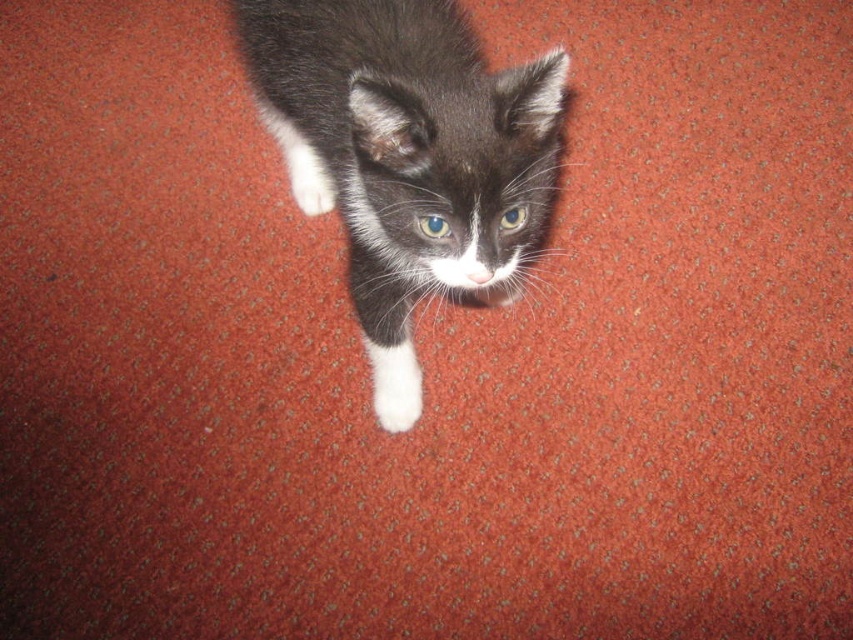
Looking at this image, you are a photographer trying to capture the black and white fur kitten at center and the white fluffy paw at center in a single frame. Since you want to ensure both are visible, which one should you focus on to avoid blurring due to their size difference?

You should focus on the black and white fur kitten at center because it is larger in size than the white fluffy paw at center, making it more likely to remain in focus if the camera is set to prioritize larger objects.

You are holding a 1.5 meter long fishing rod and want to cast it from your current position to the point marked at point (x=334, y=45). Can you reach that point with your fishing rod?

The distance between you and point (x=334, y=45) is 1.25 meters, so yes, you can reach it with your 1.5 meter long fishing rod since it is longer than the required distance.

You are a photographer trying to capture the black and white fur kitten at center and the white fluffy paw at center. Based on their positions, which one is closer to the camera?

The black and white fur kitten at center is above the white fluffy paw at center, so the kitten is closer to the camera than the paw.